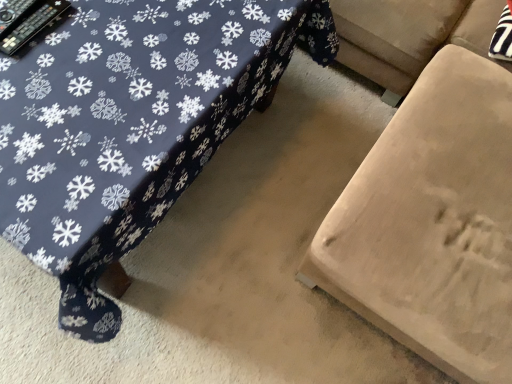
What do you see at coordinates (432, 223) in the screenshot? Image resolution: width=512 pixels, height=384 pixels. I see `beige fabric ottoman at lower right` at bounding box center [432, 223].

Identify the location of beige fabric ottoman at lower right. This screenshot has width=512, height=384. (432, 223).

In order to click on dark blue fabric table at center in this screenshot , I will do `click(131, 125)`.

Describe the element at coordinates (131, 125) in the screenshot. The image size is (512, 384). I see `dark blue fabric table at center` at that location.

This screenshot has width=512, height=384. Identify the location of beige fabric ottoman at lower right. (432, 223).

Would you say dark blue fabric table at center is to the left or to the right of beige fabric ottoman at lower right in the picture?

In the image, dark blue fabric table at center appears on the left side of beige fabric ottoman at lower right.

Considering the positions of objects dark blue fabric table at center and beige fabric ottoman at lower right in the image provided, who is behind, dark blue fabric table at center or beige fabric ottoman at lower right?

dark blue fabric table at center is further away from the camera.

Considering the positions of point (116, 311) and point (499, 164), is point (116, 311) closer or farther from the camera than point (499, 164)?

Point (116, 311) is closer to the camera than point (499, 164).

Looking at this image, from the image's perspective, relative to beige fabric ottoman at lower right, is dark blue fabric table at center above or below?

Clearly, from the image's perspective, dark blue fabric table at center is above beige fabric ottoman at lower right.

From the picture: From a real-world perspective, which object stands above the other?

beige fabric ottoman at lower right is physically above.

In terms of width, does dark blue fabric table at center look wider or thinner when compared to beige fabric ottoman at lower right?

dark blue fabric table at center is wider than beige fabric ottoman at lower right.

Can you confirm if dark blue fabric table at center is shorter than beige fabric ottoman at lower right?

Indeed, dark blue fabric table at center has a lesser height compared to beige fabric ottoman at lower right.

Considering the sizes of objects dark blue fabric table at center and beige fabric ottoman at lower right in the image provided, who is smaller, dark blue fabric table at center or beige fabric ottoman at lower right?

Smaller between the two is dark blue fabric table at center.

Would you say dark blue fabric table at center is inside or outside beige fabric ottoman at lower right?

dark blue fabric table at center is not enclosed by beige fabric ottoman at lower right.

Is dark blue fabric table at center far away from beige fabric ottoman at lower right?

dark blue fabric table at center is actually quite close to beige fabric ottoman at lower right.

Is dark blue fabric table at center positioned with its back to beige fabric ottoman at lower right?

dark blue fabric table at center does not have its back to beige fabric ottoman at lower right.

Where is `table below the beige fabric ottoman at lower right (from a real-world perspective)`? Image resolution: width=512 pixels, height=384 pixels. table below the beige fabric ottoman at lower right (from a real-world perspective) is located at coordinates (131, 125).

Which is more to the left, beige fabric ottoman at lower right or dark blue fabric table at center?

Positioned to the left is dark blue fabric table at center.

Does beige fabric ottoman at lower right come in front of dark blue fabric table at center?

Yes, beige fabric ottoman at lower right is closer to the camera.

Between point (406, 240) and point (106, 30), which one is positioned in front?

The point (406, 240) is closer.

From the image's perspective, does beige fabric ottoman at lower right appear lower than dark blue fabric table at center?

Yes.

From a real-world perspective, is beige fabric ottoman at lower right on dark blue fabric table at center?

Yes, from a real-world perspective, beige fabric ottoman at lower right is above dark blue fabric table at center.

Is beige fabric ottoman at lower right wider than dark blue fabric table at center?

Incorrect, the width of beige fabric ottoman at lower right does not surpass that of dark blue fabric table at center.

Is beige fabric ottoman at lower right taller than dark blue fabric table at center?

Correct, beige fabric ottoman at lower right is much taller as dark blue fabric table at center.

Can you confirm if beige fabric ottoman at lower right is bigger than dark blue fabric table at center?

Yes.

Is dark blue fabric table at center surrounded by beige fabric ottoman at lower right?

No, dark blue fabric table at center is not surrounded by beige fabric ottoman at lower right.

Is beige fabric ottoman at lower right positioned far away from dark blue fabric table at center?

beige fabric ottoman at lower right is actually quite close to dark blue fabric table at center.

Is beige fabric ottoman at lower right facing towards dark blue fabric table at center?

Yes, beige fabric ottoman at lower right is aimed at dark blue fabric table at center.

How many degrees apart are the facing directions of beige fabric ottoman at lower right and dark blue fabric table at center?

There is a 90-degree angle between the facing directions of beige fabric ottoman at lower right and dark blue fabric table at center.

Consider the image. Measure the distance between beige fabric ottoman at lower right and dark blue fabric table at center.

beige fabric ottoman at lower right and dark blue fabric table at center are 19.05 inches apart from each other.

The width and height of the screenshot is (512, 384). I want to click on table on the left of beige fabric ottoman at lower right, so click(x=131, y=125).

At what (x,y) coordinates should I click in order to perform the action: click on table above the beige fabric ottoman at lower right (from the image's perspective). Please return your answer as a coordinate pair (x, y). Looking at the image, I should click on (131, 125).

Locate an element on the screen. table directly beneath the beige fabric ottoman at lower right (from a real-world perspective) is located at coordinates (131, 125).